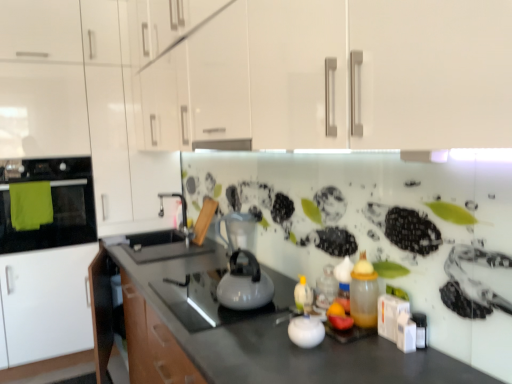
Question: Should I look upward or downward to see satin silver kettle at center, the 1th appliance from the top?

Choices:
 (A) down
 (B) up

Answer: (A)

Question: From the image's perspective, does green fabric oven at left appear lower than translucent plastic bottle at center-right, positioned as the 2th bottle in back-to-front order?

Choices:
 (A) yes
 (B) no

Answer: (B)

Question: Is green fabric oven at left looking in the opposite direction of translucent plastic bottle at center-right, which ranks as the first bottle in front-to-back order?

Choices:
 (A) no
 (B) yes

Answer: (A)

Question: Is green fabric oven at left taller than translucent plastic bottle at center-right, positioned as the 2th bottle in back-to-front order?

Choices:
 (A) no
 (B) yes

Answer: (B)

Question: Is green fabric oven at left further to camera compared to translucent plastic bottle at center-right, positioned as the 2th bottle in back-to-front order?

Choices:
 (A) no
 (B) yes

Answer: (B)

Question: Does green fabric oven at left appear on the right side of translucent plastic bottle at center-right, which ranks as the first bottle in front-to-back order?

Choices:
 (A) yes
 (B) no

Answer: (B)

Question: Is green fabric oven at left closer to camera compared to translucent plastic bottle at center-right, which ranks as the first bottle in front-to-back order?

Choices:
 (A) yes
 (B) no

Answer: (B)

Question: Is white glossy kettle at center inside white glossy cabinets at upper left?

Choices:
 (A) yes
 (B) no

Answer: (B)

Question: Does white glossy cabinets at upper left touch white glossy kettle at center?

Choices:
 (A) yes
 (B) no

Answer: (B)

Question: Is the position of white glossy cabinets at upper left less distant than that of white glossy kettle at center?

Choices:
 (A) yes
 (B) no

Answer: (B)

Question: Is white glossy cabinets at upper left not close to white glossy kettle at center?

Choices:
 (A) no
 (B) yes

Answer: (B)

Question: From a real-world perspective, is white glossy cabinets at upper left positioned over white glossy kettle at center based on gravity?

Choices:
 (A) no
 (B) yes

Answer: (B)

Question: Considering the relative positions of white glossy cabinets at upper left and white glossy kettle at center in the image provided, is white glossy cabinets at upper left to the left of white glossy kettle at center from the viewer's perspective?

Choices:
 (A) yes
 (B) no

Answer: (A)

Question: Is the surface of white glossy kettle at center in direct contact with translucent plastic bottle at center, which ranks as the second bottle in front-to-back order?

Choices:
 (A) no
 (B) yes

Answer: (A)